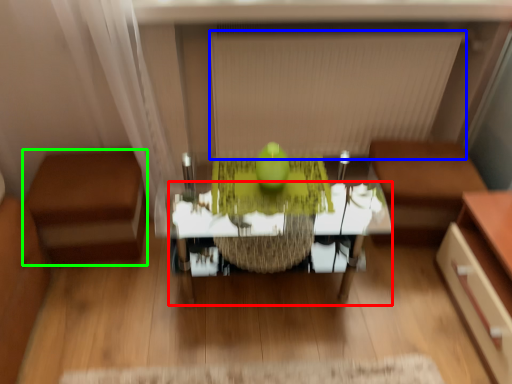
Question: Based on their relative distances, which object is farther from table (highlighted by a red box)? Choose from blind (highlighted by a blue box) and furniture (highlighted by a green box).

Choices:
 (A) blind
 (B) furniture

Answer: (A)